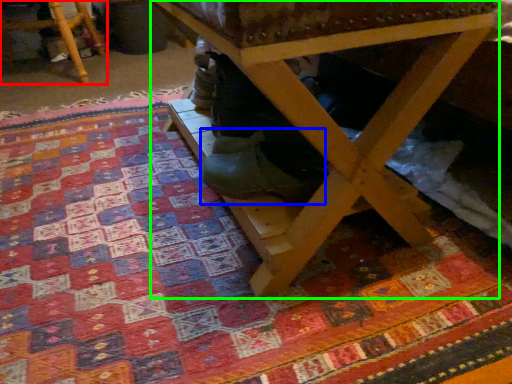
Question: Estimate the real-world distances between objects in this image. Which object is farther from furniture (highlighted by a red box), shoe (highlighted by a blue box) or table (highlighted by a green box)?

Choices:
 (A) shoe
 (B) table

Answer: (B)